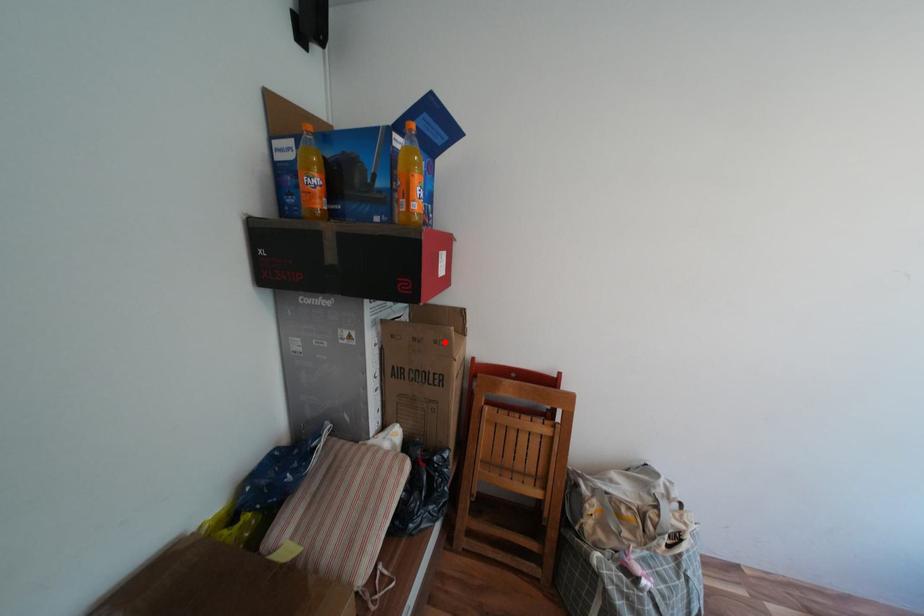
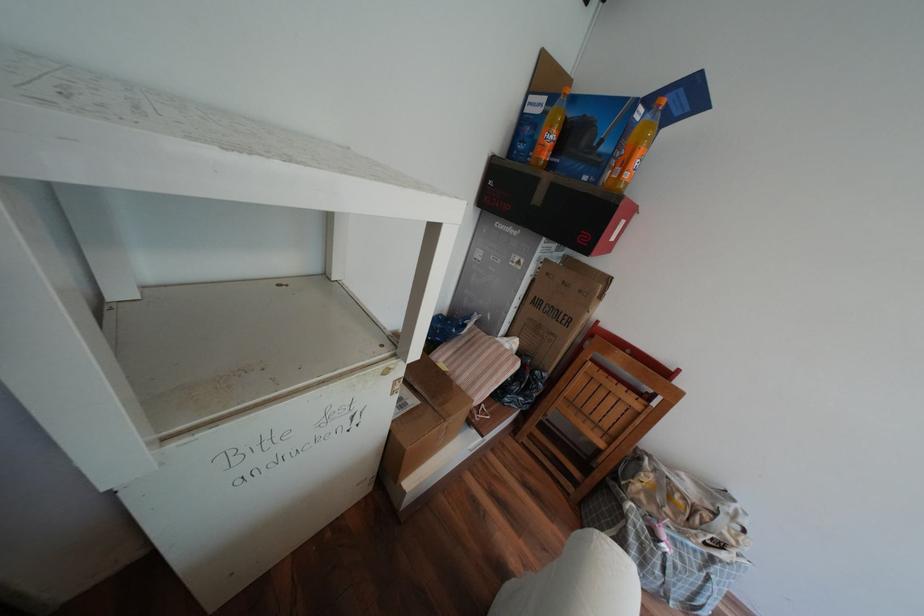
In the second image, find the point that corresponds to the highlighted location in the first image.

(590, 291)